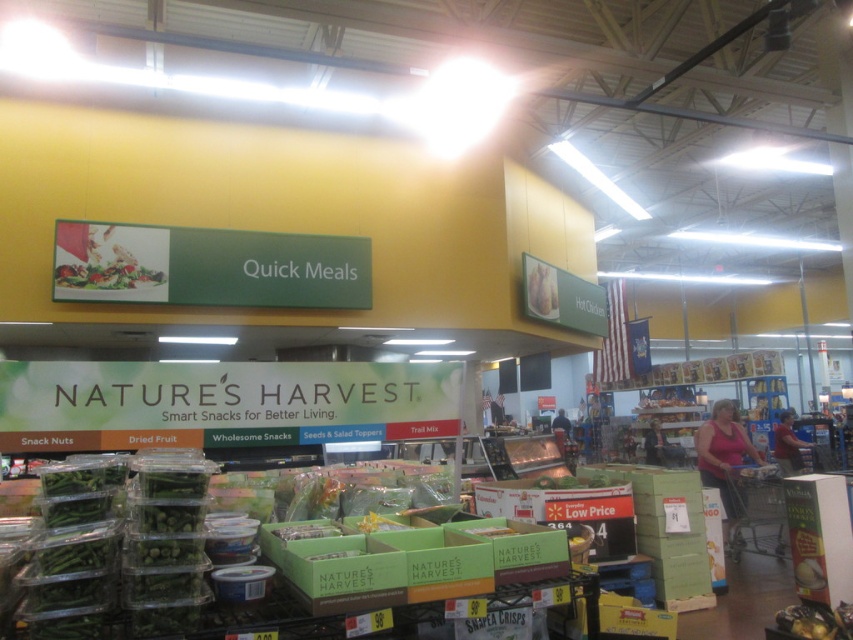
You are standing in the grocery store looking at the Quick Meals section. There are two points marked on the floor at coordinates point (722, 497) and point (68, 282). Which point is closer to you?

Point (68, 282) is closer to you because it is less further to the camera than point (722, 497).

In the grocery store scene, there is a point labeled at coordinates (x=723, y=454). Based on the Quick Meals section layout, what object or feature does this point most likely represent?

The point at coordinates (x=723, y=454) corresponds to the pink fabric shirt at lower right.

You are a customer in the grocery store and want to place the pink fabric shirt at lower right on top of the matte plastic salad at upper center. Will the shirt fit entirely on top of the salad?

The pink fabric shirt at lower right has a smaller width than the matte plastic salad at upper center, so it can fit entirely on top of the salad.